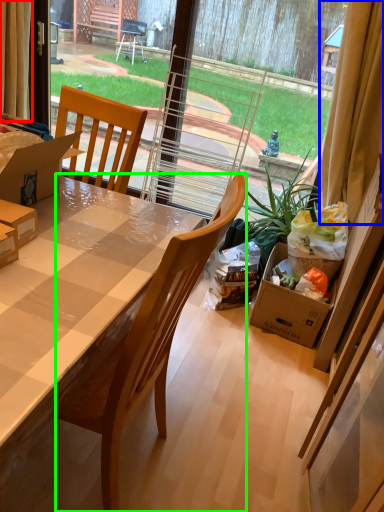
Question: Which object is positioned farthest from curtain (highlighted by a red box)? Select from curtain (highlighted by a blue box) and chair (highlighted by a green box).

Choices:
 (A) curtain
 (B) chair

Answer: (A)